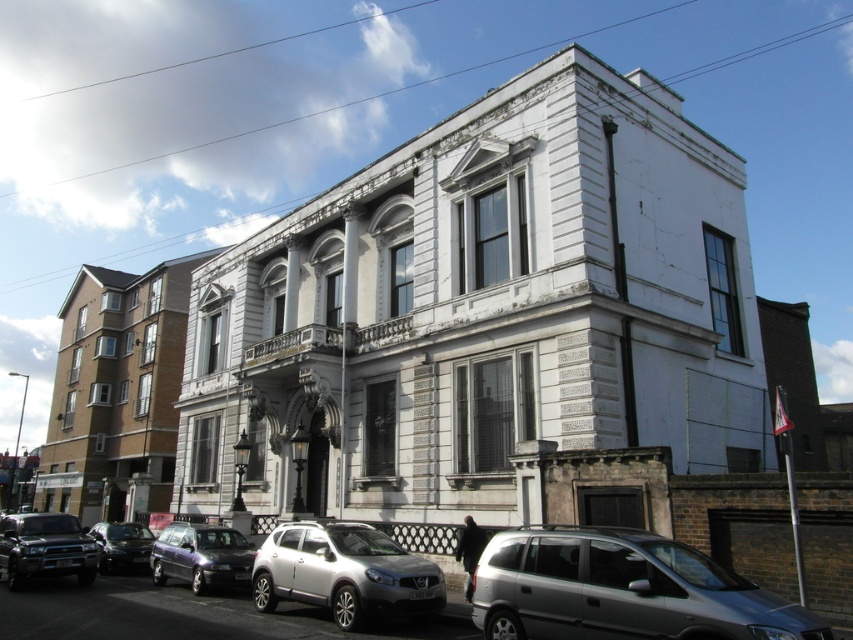
Question: Does silver metallic van at center lie behind metallic purple car at lower left?

Choices:
 (A) no
 (B) yes

Answer: (A)

Question: Is metallic purple car at lower left smaller than shiny black sedan at lower left?

Choices:
 (A) no
 (B) yes

Answer: (B)

Question: Which object appears closest to the camera in this image?

Choices:
 (A) metallic purple car at lower left
 (B) silver metallic suv at lower center

Answer: (B)

Question: Which point appears farthest from the camera in this image?

Choices:
 (A) (310, 532)
 (B) (115, 560)
 (C) (161, 577)
 (D) (4, 531)

Answer: (B)

Question: In this image, where is silver metallic van at center located relative to metallic purple car at lower left?

Choices:
 (A) below
 (B) above

Answer: (B)

Question: Among these points, which one is farthest from the camera?

Choices:
 (A) (143, 528)
 (B) (372, 584)
 (C) (212, 557)

Answer: (A)